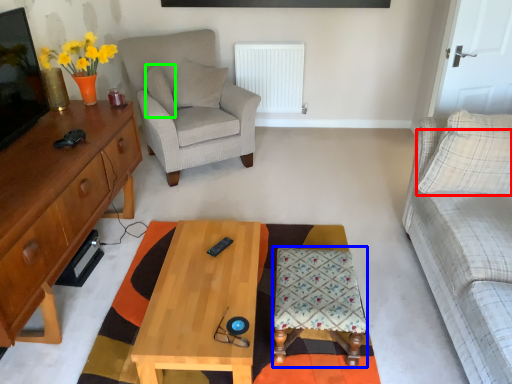
Question: Based on their relative distances, which object is farther from pillow (highlighted by a red box)? Choose from stool (highlighted by a blue box) and pillow (highlighted by a green box).

Choices:
 (A) stool
 (B) pillow

Answer: (B)